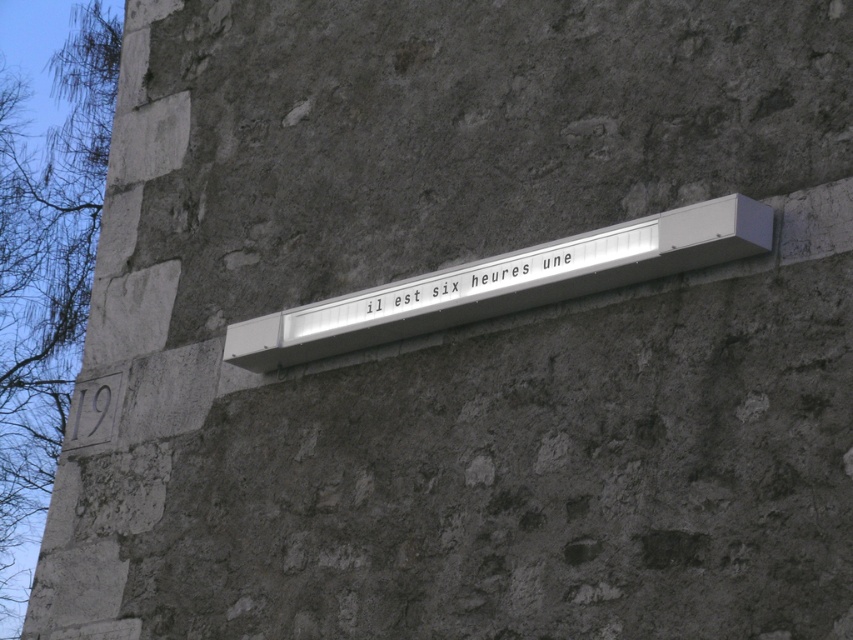
Question: In this image, where is white plastic sign at center located relative to white metallic sign at center?

Choices:
 (A) above
 (B) below

Answer: (B)

Question: Which point is farther to the camera?

Choices:
 (A) (520, 256)
 (B) (256, 317)

Answer: (B)

Question: From the image, what is the correct spatial relationship of white plastic sign at center in relation to white metallic sign at center?

Choices:
 (A) left
 (B) right

Answer: (B)

Question: Which point is closer to the camera?

Choices:
 (A) (285, 358)
 (B) (376, 304)

Answer: (B)

Question: Does white plastic sign at center appear under white metallic sign at center?

Choices:
 (A) no
 (B) yes

Answer: (B)